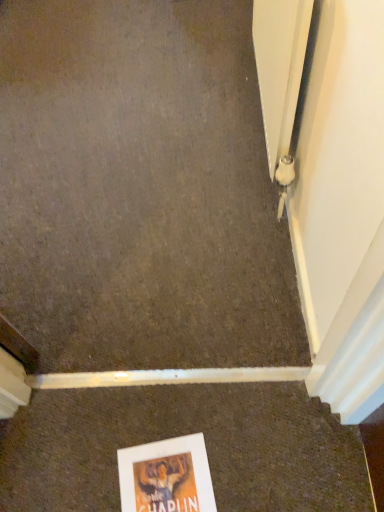
Identify the location of vacant point above white matte picture frame at lower center (from a real-world perspective). The width and height of the screenshot is (384, 512). (163, 483).